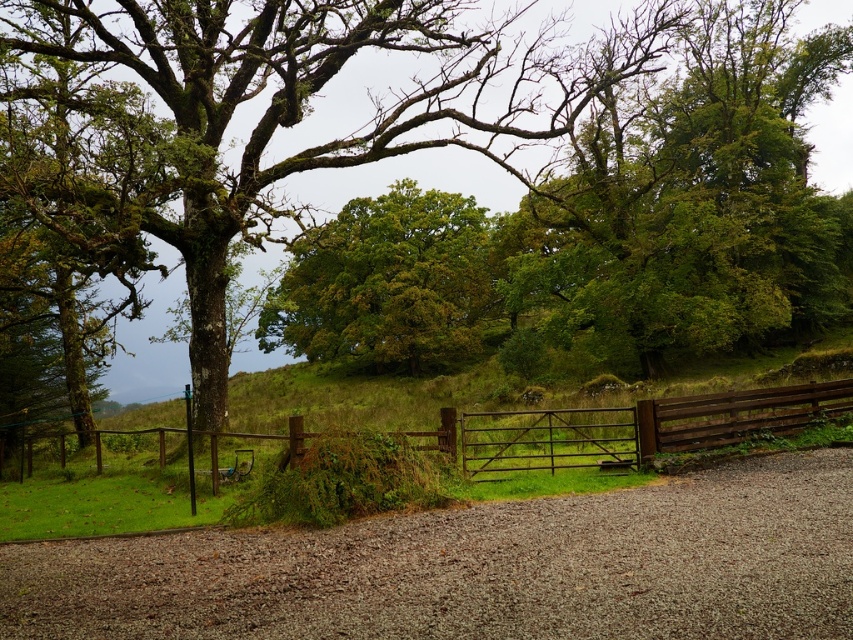
Based on the photo, you are standing at the entrance of the driveway and want to walk to the middle of the gravelly path at center. According to the coordinates provided, what direction should you move in?

The gravelly path at center is located at coordinates point (480, 568), so you should move towards the right and forward to reach the middle of the gravelly path at center.

You are standing at the entrance of the driveway and see the gravelly path at center and the green mossy tree at center. Which object is positioned to the right of the other?

The gravelly path at center is to the right of the green mossy tree at center.

You are a gardener standing at the entrance of the driveway. You notice the gravelly path at center and the green leafy tree at center. Which object is closer to the ground?

The gravelly path at center is closer to the ground since it has a lesser height compared to the green leafy tree at center.